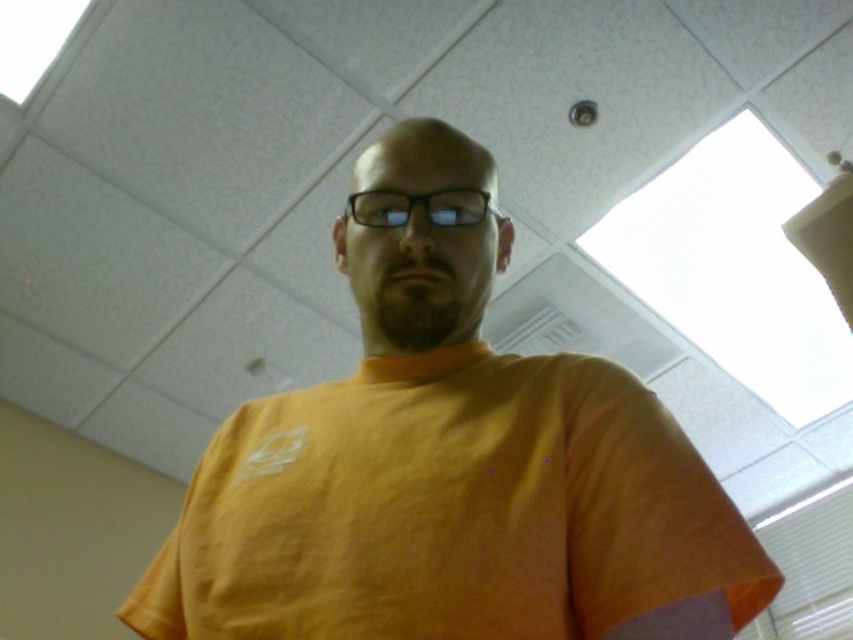
Which is more to the right, orange t-shirt at center or transparent plastic glasses at center?

transparent plastic glasses at center

Is point (541, 456) positioned before point (430, 202)?

Yes.

Find the location of `orange t-shirt at center`. orange t-shirt at center is located at coordinates (451, 486).